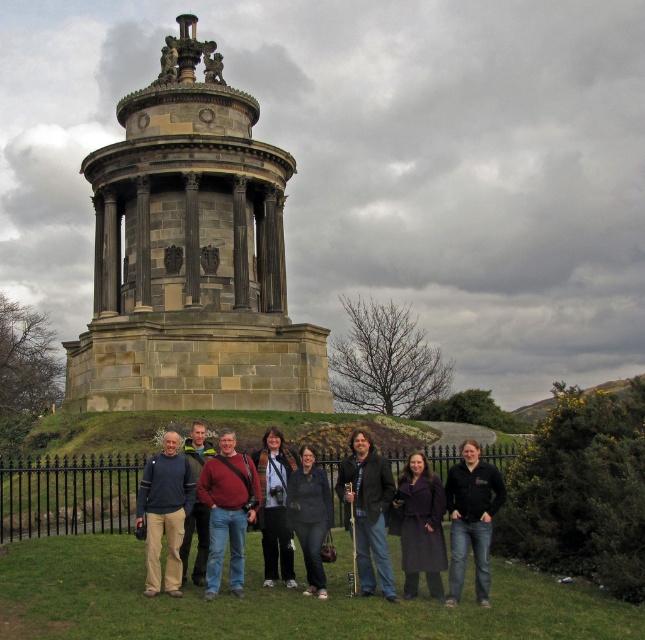
Question: Which point is closer to the camera taking this photo?

Choices:
 (A) (259, 472)
 (B) (424, 484)
 (C) (270, 365)

Answer: (B)

Question: Can you confirm if knitted sweater at center is bigger than dark gray fabric jacket at center?

Choices:
 (A) no
 (B) yes

Answer: (A)

Question: Is brown stone tower at center smaller than dark brown leather coat at center?

Choices:
 (A) no
 (B) yes

Answer: (A)

Question: Does dark gray sweater at center have a greater width compared to dark blue denim jacket at center?

Choices:
 (A) no
 (B) yes

Answer: (B)

Question: Which point is farther to the camera?

Choices:
 (A) knitted sweater at center
 (B) dark blue jacket at center
 (C) brown stone tower at center

Answer: (C)

Question: Estimate the real-world distances between objects in this image. Which object is closer to the dark blue jacket at center?

Choices:
 (A) brown stone tower at center
 (B) dark gray sweater at center
 (C) dark gray fabric jacket at center
 (D) black matte jacket at lower right

Answer: (B)